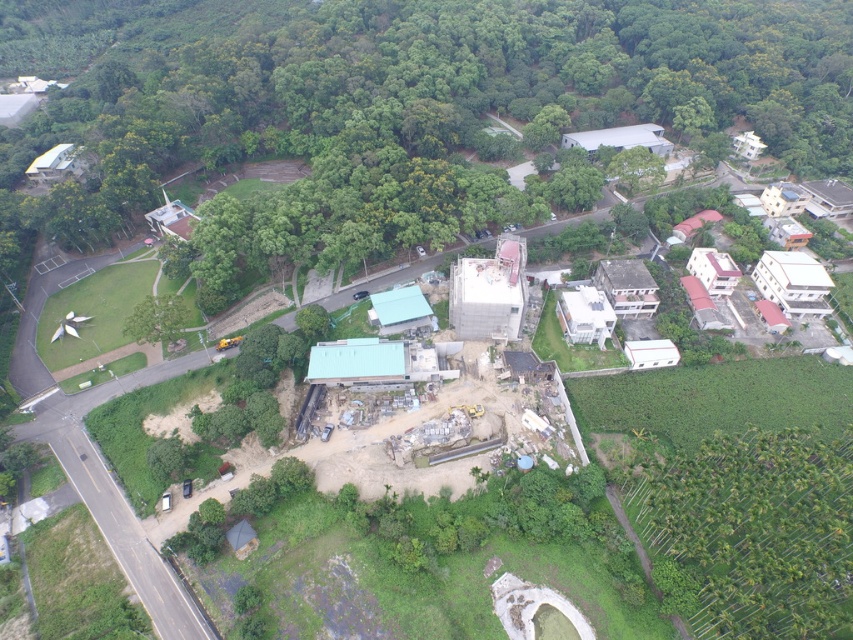
Question: Is green leafy tree at upper center closer to camera compared to green leafy trees at lower right?

Choices:
 (A) no
 (B) yes

Answer: (A)

Question: Among these objects, which one is farthest from the camera?

Choices:
 (A) green leafy tree at upper center
 (B) green leafy trees at lower right

Answer: (A)

Question: Among these points, which one is farthest from the camera?

Choices:
 (A) (775, 465)
 (B) (383, 156)

Answer: (B)

Question: Is green leafy tree at upper center smaller than green leafy trees at lower right?

Choices:
 (A) yes
 (B) no

Answer: (B)

Question: Does green leafy tree at upper center have a smaller size compared to green leafy trees at lower right?

Choices:
 (A) no
 (B) yes

Answer: (A)

Question: Which object is closer to the camera taking this photo?

Choices:
 (A) green leafy tree at upper center
 (B) green leafy trees at lower right

Answer: (B)